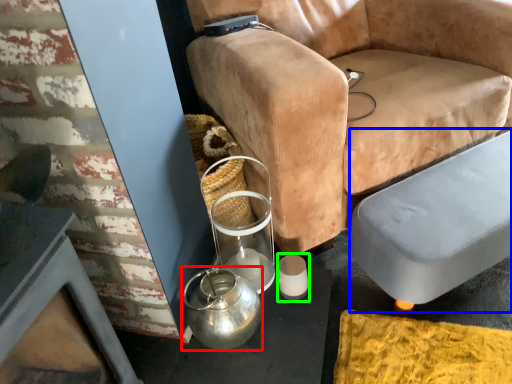
Question: Which is nearer to the tea pot (highlighted by a red box)? swivel chair (highlighted by a blue box) or candle holder (highlighted by a green box).

Choices:
 (A) swivel chair
 (B) candle holder

Answer: (B)